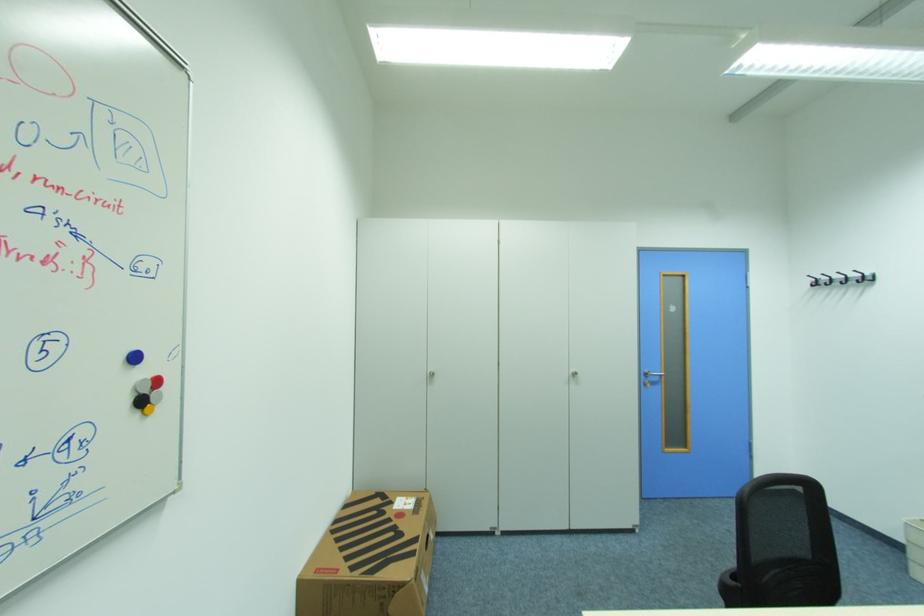
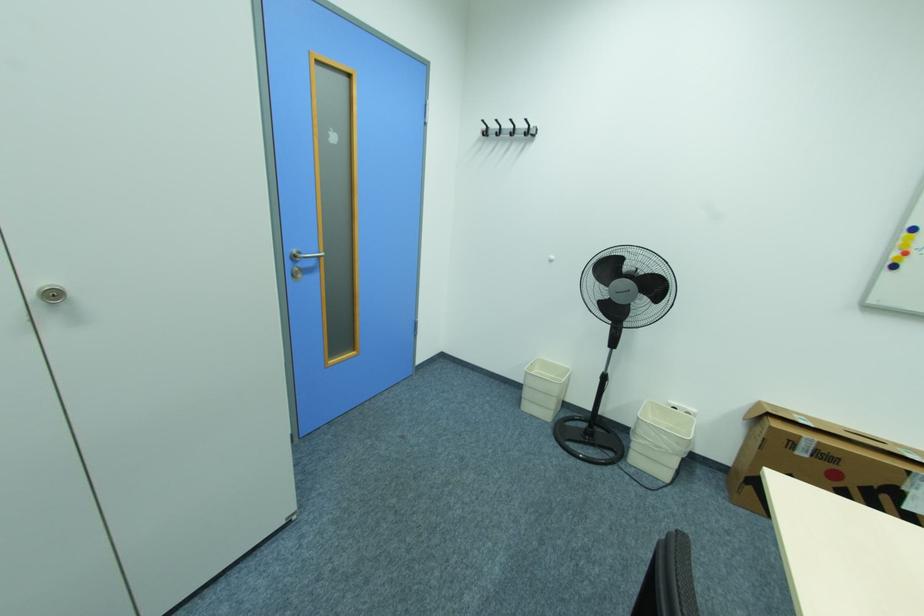
Find the pixel in the second image that matches pixel 821 284 in the first image.

(492, 132)